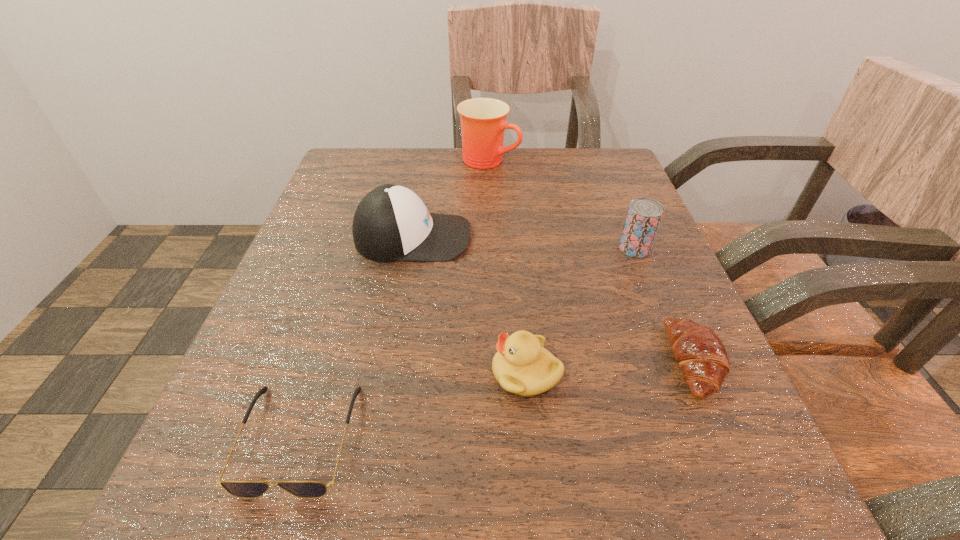
Locate an element on the screen. This screenshot has width=960, height=540. free location located on the front-facing side of the duckling is located at coordinates click(316, 373).

Locate an element on the screen. vacant area situated on the front-facing side of the duckling is located at coordinates (396, 373).

This screenshot has width=960, height=540. In order to click on vacant area situated on the front-facing side of the duckling in this screenshot , I will do `click(374, 373)`.

I want to click on vacant space located 0.060m on the left of the crescent roll, so click(x=628, y=361).

The width and height of the screenshot is (960, 540). I want to click on object that is at the far edge, so click(x=483, y=120).

Find the location of a particular element. object located in the near edge section of the desktop is located at coordinates (242, 489).

Where is `cap that is at the left edge`? cap that is at the left edge is located at coordinates tap(391, 223).

Where is `sunglasses that is at the left edge`? sunglasses that is at the left edge is located at coordinates (242, 489).

At what (x,y) coordinates should I click in order to perform the action: click on beer can present at the right edge. Please return your answer as a coordinate pair (x, y). The height and width of the screenshot is (540, 960). Looking at the image, I should click on (644, 215).

Where is `crescent roll at the right edge`? crescent roll at the right edge is located at coordinates (700, 353).